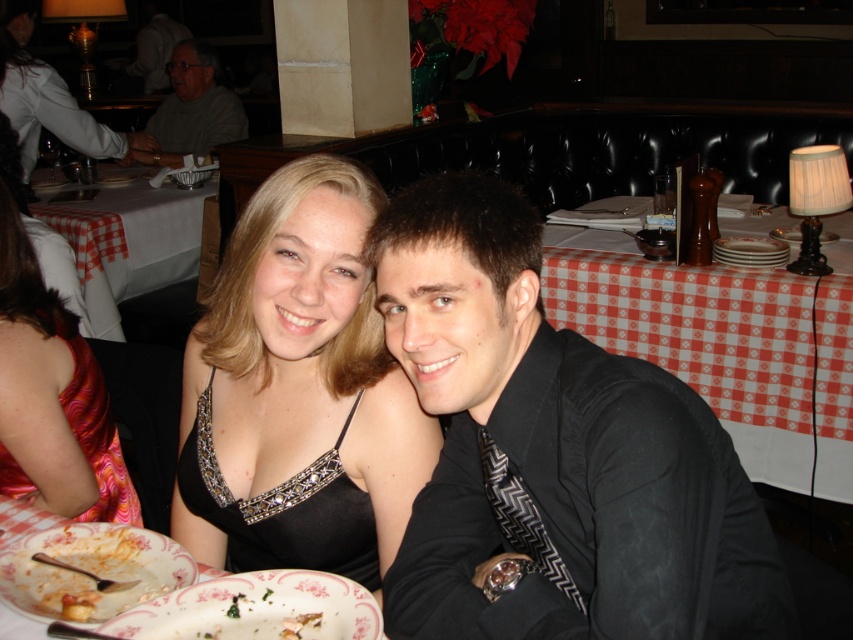
Between point (550, 253) and point (763, 259), which one is positioned in front?

Point (763, 259) is in front.

Can you confirm if red checkered tablecloth at upper right is bigger than white glossy platter at upper right?

Correct, red checkered tablecloth at upper right is larger in size than white glossy platter at upper right.

Find the location of a particular element. The height and width of the screenshot is (640, 853). red checkered tablecloth at upper right is located at coordinates (698, 337).

Does black satin shirt at center have a smaller size compared to black satin dress at center?

No, black satin shirt at center is not smaller than black satin dress at center.

Does point (711, 474) lie behind point (374, 541)?

No, it is in front of (374, 541).

What do you see at coordinates (553, 452) in the screenshot? I see `black satin shirt at center` at bounding box center [553, 452].

Locate an element on the screen. This screenshot has width=853, height=640. black satin shirt at center is located at coordinates (553, 452).

Is black satin dress at center taller than red checkered tablecloth at upper right?

In fact, black satin dress at center may be shorter than red checkered tablecloth at upper right.

I want to click on black satin dress at center, so click(299, 392).